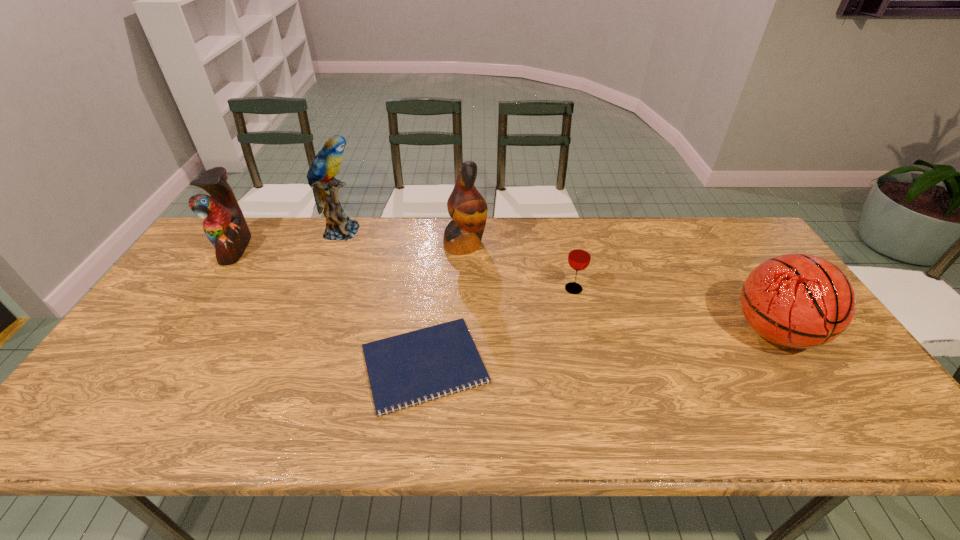
Identify the location of the second parrot from right to left. The height and width of the screenshot is (540, 960). (321, 175).

At what (x,y) coordinates should I click in order to perform the action: click on the rightmost parrot. Please return your answer as a coordinate pair (x, y). Looking at the image, I should click on click(x=466, y=206).

What are the coordinates of `the shortest parrot` in the screenshot? It's located at (224, 225).

Identify the location of the leftmost parrot. (224, 225).

What are the coordinates of `basketball` in the screenshot? It's located at (795, 300).

Find the location of a particular element. This screenshot has width=960, height=540. glass is located at coordinates (579, 257).

You are a GUI agent. You are given a task and a screenshot of the screen. Output one action in this format:
    pyautogui.click(x=<x>, y=<y>)
    Task: Click on the fifth object from left to right
    This screenshot has width=960, height=540.
    Given the screenshot: What is the action you would take?
    pyautogui.click(x=579, y=257)

At what (x,y) coordinates should I click in order to perform the action: click on the shortest object. Please return your answer as a coordinate pair (x, y). Looking at the image, I should click on [x=432, y=362].

Locate an element on the screen. The image size is (960, 540). free space located on the face of the fifth object from right to left is located at coordinates (483, 231).

Identify the location of vacant space located 0.330m on the face of the rightmost parrot. The image size is (960, 540). (588, 244).